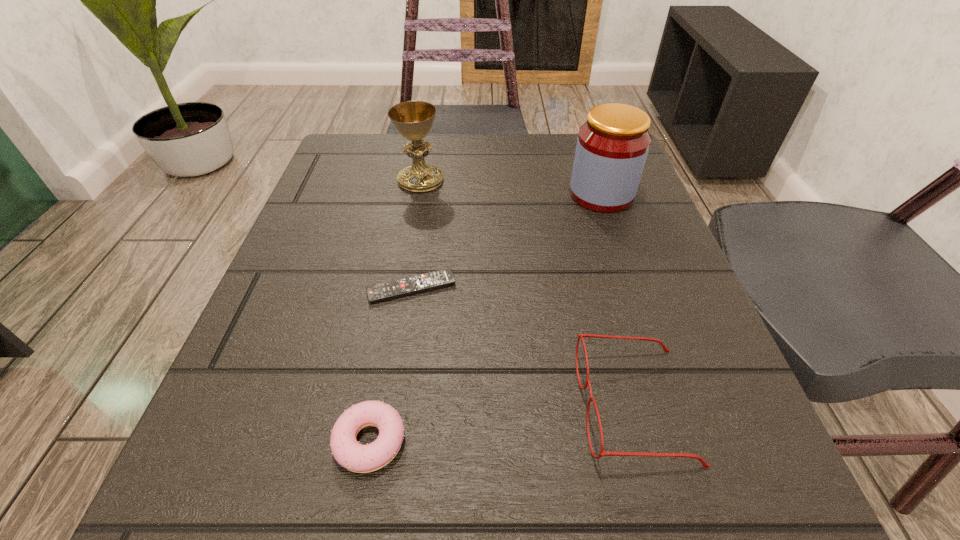
Locate an element on the screen. The width and height of the screenshot is (960, 540). jar that is at the right edge is located at coordinates (612, 146).

Where is `spectacles that is positioned at the right edge`? The height and width of the screenshot is (540, 960). spectacles that is positioned at the right edge is located at coordinates (705, 465).

Where is `object that is at the far left corner`? This screenshot has width=960, height=540. object that is at the far left corner is located at coordinates (413, 120).

Identify the location of object situated at the near left corner. Image resolution: width=960 pixels, height=540 pixels. (346, 450).

Identify the location of object at the far right corner. (612, 146).

Where is `object that is at the near right corner`? The width and height of the screenshot is (960, 540). object that is at the near right corner is located at coordinates (705, 465).

Where is `free space at the far edge of the desktop`? The height and width of the screenshot is (540, 960). free space at the far edge of the desktop is located at coordinates pos(531,143).

In the image, there is a desktop. Where is `vacant space at the left edge`? Image resolution: width=960 pixels, height=540 pixels. vacant space at the left edge is located at coordinates (240, 399).

Identify the location of vacant space at the right edge of the desktop. (632, 273).

In the image, there is a desktop. Identify the location of free space at the far left corner. (356, 134).